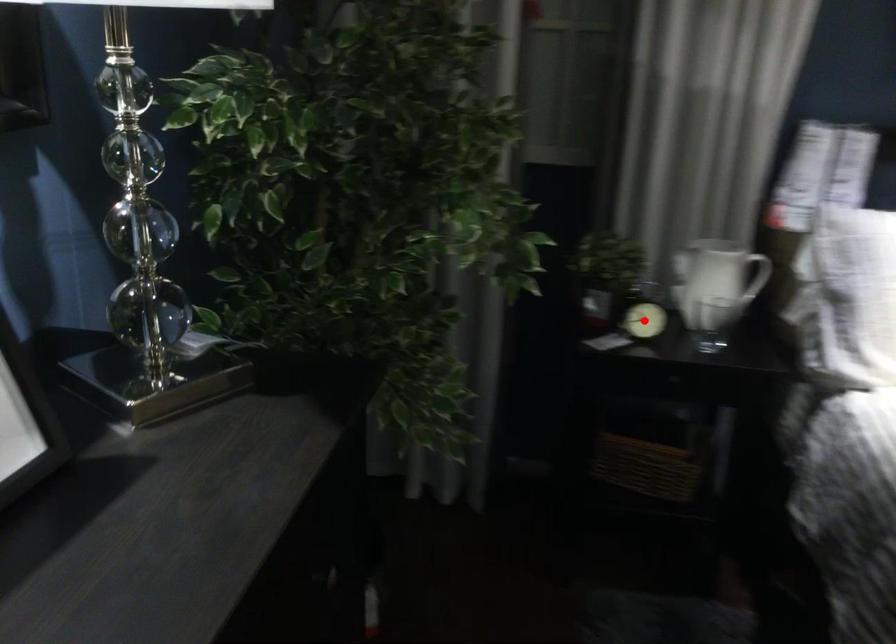
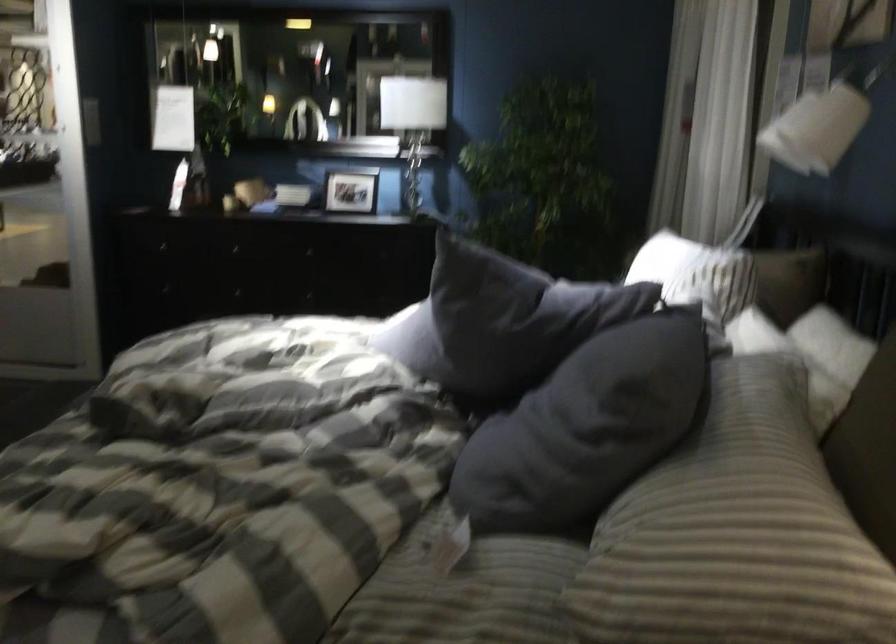
Question: I am providing you with two images of the same scene from different viewpoints. A red point is marked on the first image. At the location where the point appears in image 1, is it still visible in image 2?

Choices:
 (A) Yes
 (B) No

Answer: (B)